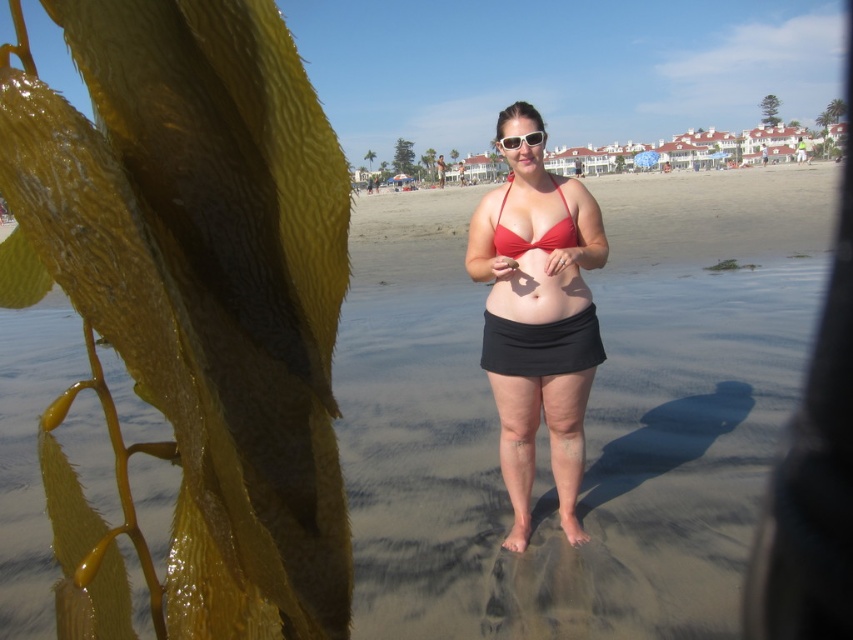
You are a photographer trying to capture the perfect shot of the woman in the beach scene. You notice the matte skin at center and the matte red bikini top at center. Which object should you focus on if you want to emphasize the subject with the larger area in your photo?

The matte skin at center is larger in size than the matte red bikini top at center, so focusing on the matte skin at center would emphasize the subject with the larger area.

You are a photographer trying to capture the red matte bikini top at center in your shot. Based on the scene description, where should you position your camera to ensure the bikini top is centered in the frame?

The red matte bikini top at center is already positioned at the center of the image, specifically at coordinates point (538, 324). Therefore, positioning the camera to center on these coordinates will ensure the bikini top is centered in the frame.